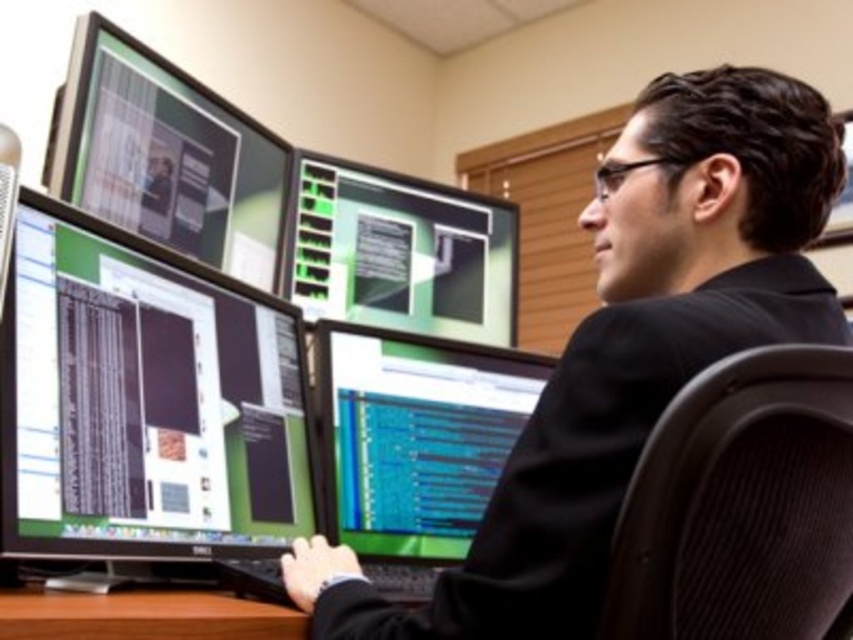
You are a delivery person who needs to place a package on the desk without touching any of the monitors. The package is 40 centimeters wide. Considering the space between the black glossy suit at center and the matte black monitor at left, will the package fit there?

The distance between the black glossy suit at center and the matte black monitor at left is 37.51 centimeters. Since the package is 40 centimeters wide, it will not fit in the available space.

You are organizing a presentation and need to place a 12 inch laptop on the brown wood table at lower center. The black glossy monitor at left is currently occupying space on the table. Can the laptop fit on the table without overlapping the monitor?

The brown wood table at lower center is wider than the black glossy monitor at left, so the 12 inch laptop can fit on the table without overlapping the monitor as long as there is enough space around the monitor.

You are standing in the room and notice a point marked at coordinates (144, 616). Based on the scene description, what object is located at this point?

The point at coordinates (144, 616) indicates the brown wood table at lower center.